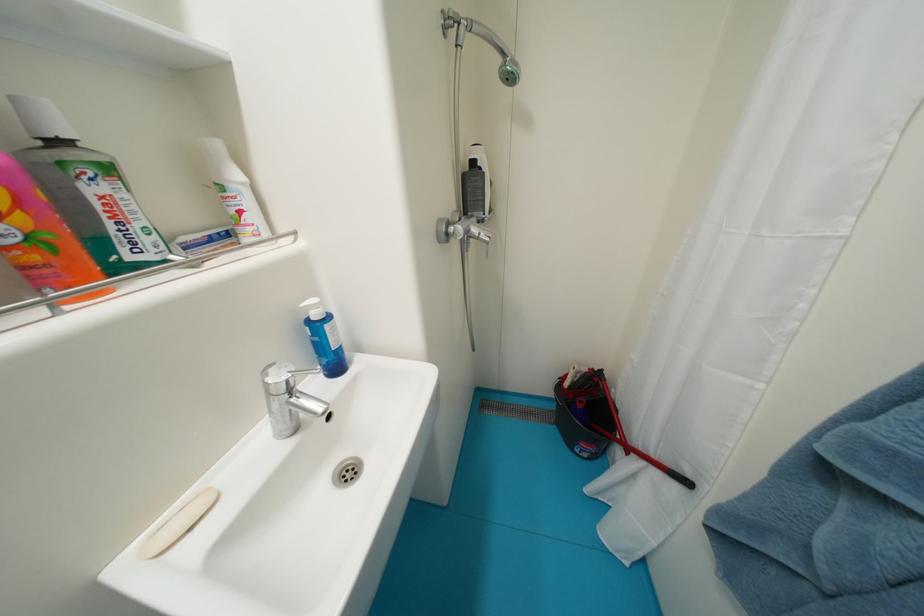
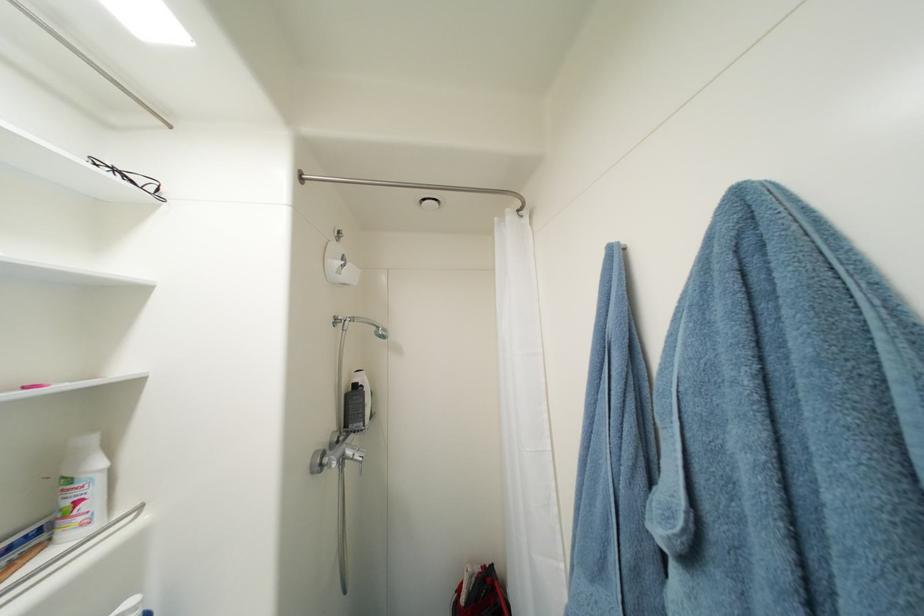
Locate, in the second image, the point that corresponds to (x=247, y=214) in the first image.

(84, 504)